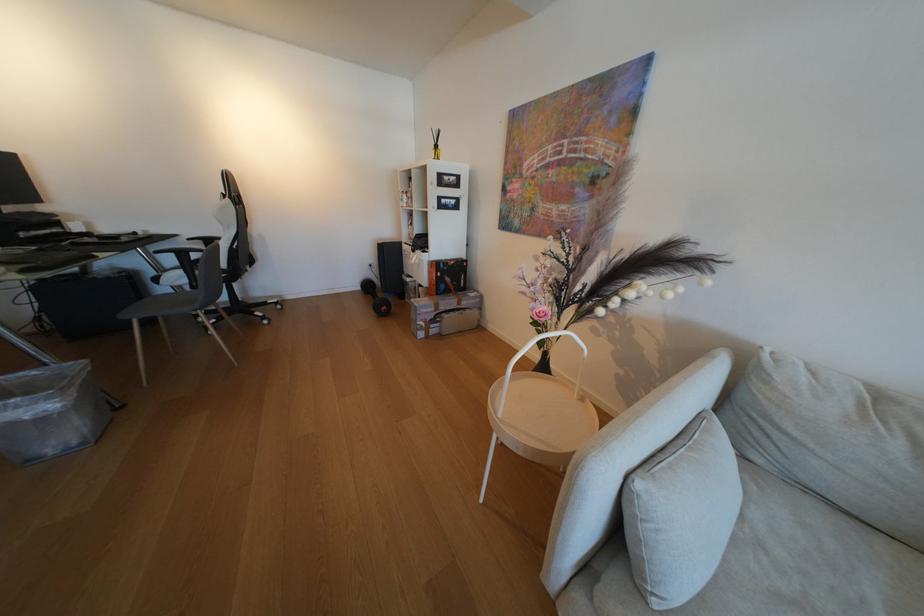
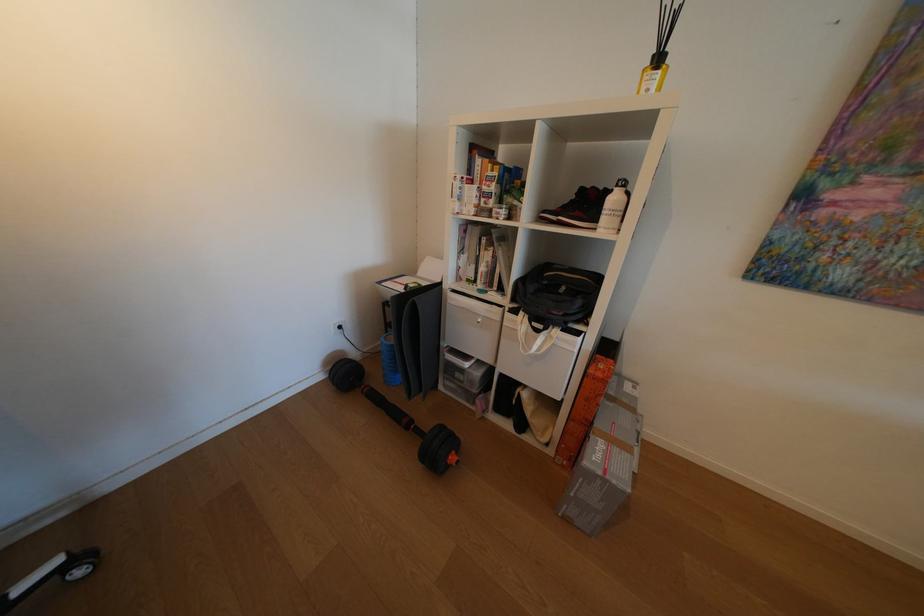
The point at (371, 290) is marked in the first image. Where is the corresponding point in the second image?

(331, 379)